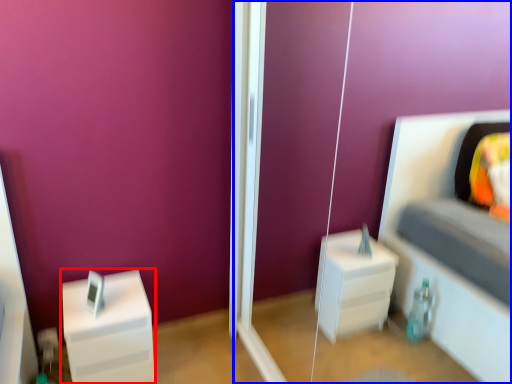
Question: Which object is further to the camera taking this photo, furniture (highlighted by a red box) or glass door (highlighted by a blue box)?

Choices:
 (A) furniture
 (B) glass door

Answer: (A)